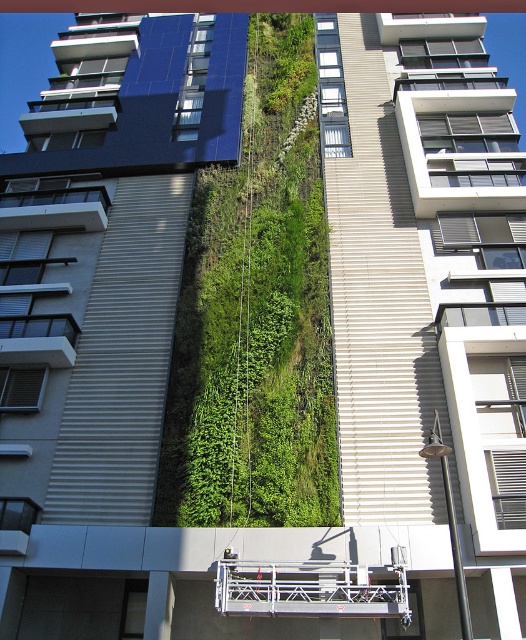
Question: Which object appears farthest from the camera in this image?

Choices:
 (A) green leafy plant at center
 (B) blue glossy solar panel at upper left

Answer: (B)

Question: Can you confirm if green leafy plant at center is bigger than blue glossy solar panel at upper left?

Choices:
 (A) yes
 (B) no

Answer: (B)

Question: Is green leafy plant at center below blue glossy solar panel at upper left?

Choices:
 (A) yes
 (B) no

Answer: (A)

Question: Is green leafy plant at center wider than blue glossy solar panel at upper left?

Choices:
 (A) no
 (B) yes

Answer: (A)